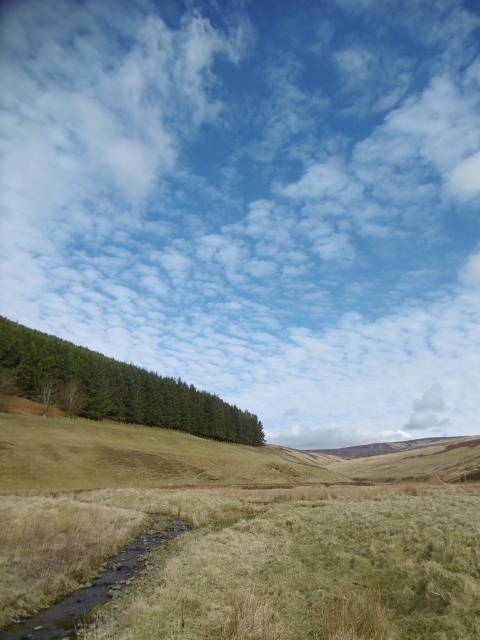
You are standing at the edge of the field in the rural landscape and want to walk towards the two points marked in the image. Which point, point (147, 406) or point (146, 532), will you reach first?

Point (147, 406) is closer to you than point (146, 532), so you will reach point (147, 406) first.

You are an airplane pilot flying over the rural landscape. You notice the green matte forest at left and the white fluffy cloud at upper center. Which one is closer to your current altitude?

The white fluffy cloud at upper center is closer to your current altitude because the green matte forest at left is behind it, meaning the cloud is positioned in front of the forest and thus at a lower elevation relative to the airplane.